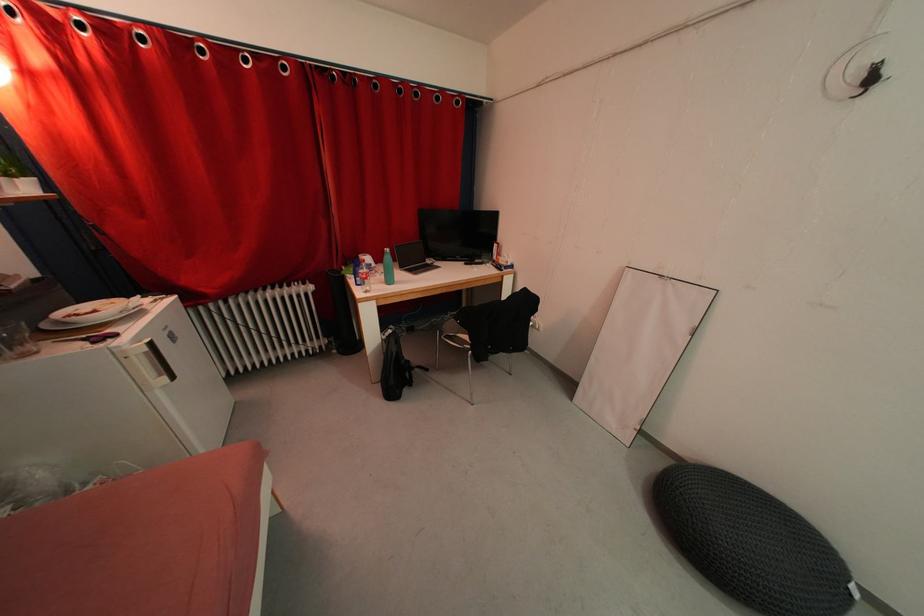
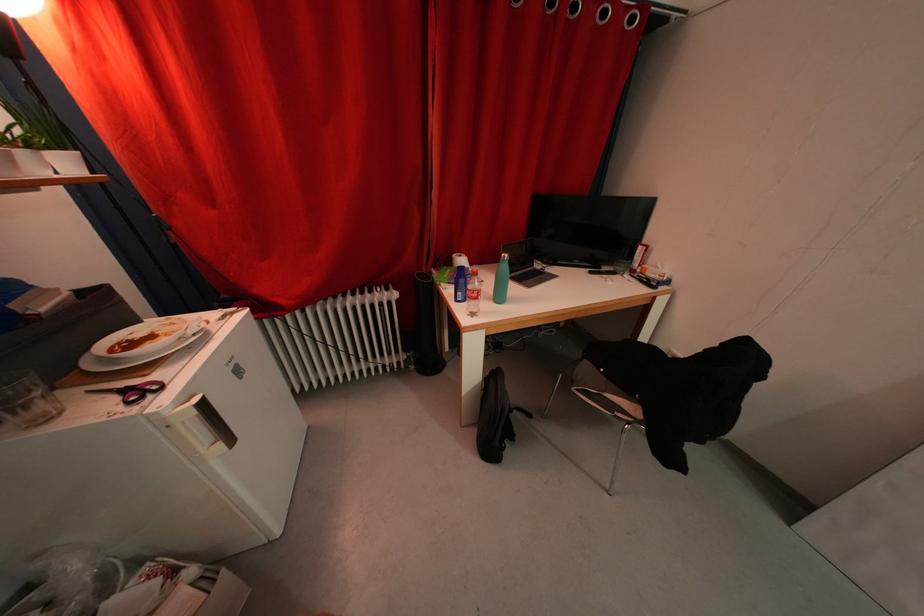
Locate, in the second image, the point that corresponds to point (367, 275) in the first image.

(476, 291)